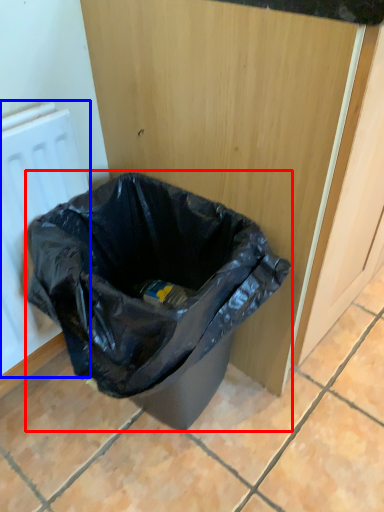
Question: Which of the following is the farthest to the observer, waste container (highlighted by a red box) or radiator (highlighted by a blue box)?

Choices:
 (A) waste container
 (B) radiator

Answer: (B)